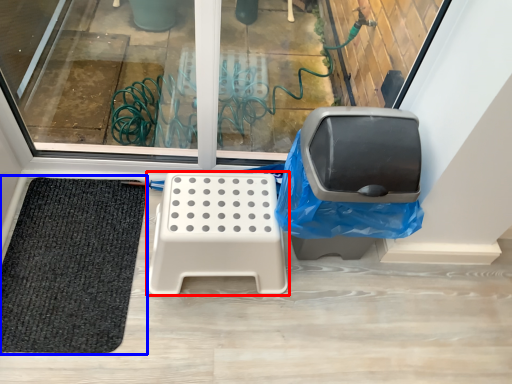
Question: Which object appears closest to the camera in this image, furniture (highlighted by a red box) or mat (highlighted by a blue box)?

Choices:
 (A) furniture
 (B) mat

Answer: (A)